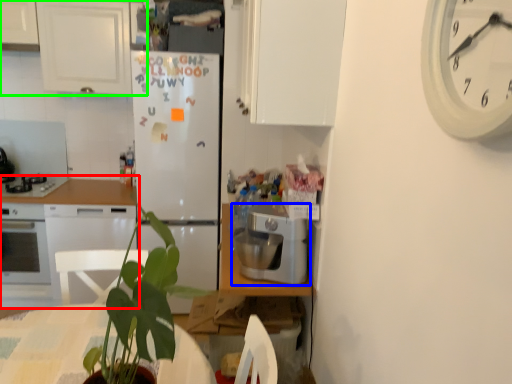
Question: Which object is the closest to the countertop (highlighted by a red box)? Choose among these: kitchen appliance (highlighted by a blue box) or cabinetry (highlighted by a green box).

Choices:
 (A) kitchen appliance
 (B) cabinetry

Answer: (B)